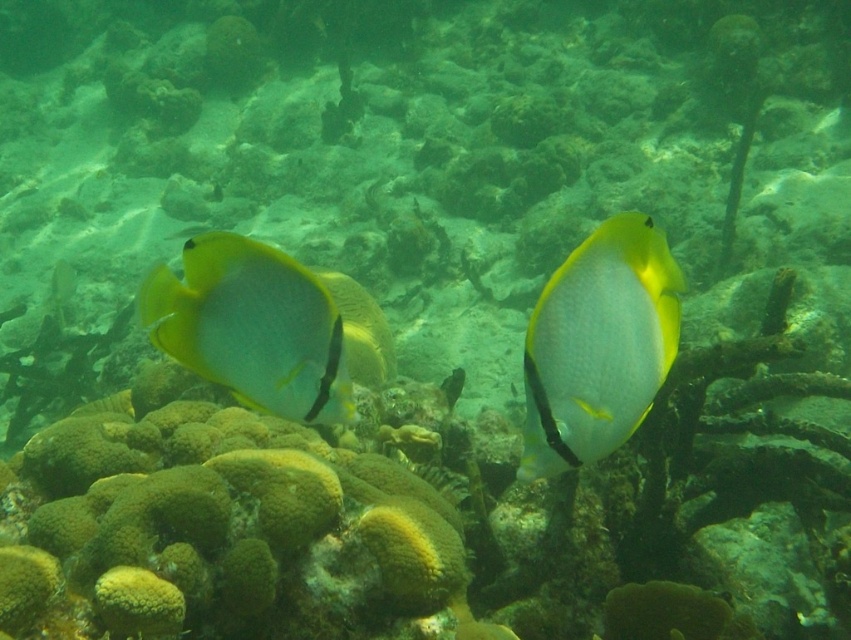
Question: Which point appears closest to the camera in this image?

Choices:
 (A) (260, 388)
 (B) (534, 456)

Answer: (B)

Question: Which point appears closest to the camera in this image?

Choices:
 (A) (650, 305)
 (B) (250, 369)

Answer: (A)

Question: Can you confirm if shiny yellow fish at center is positioned above translucent yellow fish at center?

Choices:
 (A) no
 (B) yes

Answer: (A)

Question: In this image, where is shiny yellow fish at center located relative to translucent yellow fish at center?

Choices:
 (A) above
 (B) below

Answer: (B)

Question: Is shiny yellow fish at center wider than translucent yellow fish at center?

Choices:
 (A) no
 (B) yes

Answer: (A)